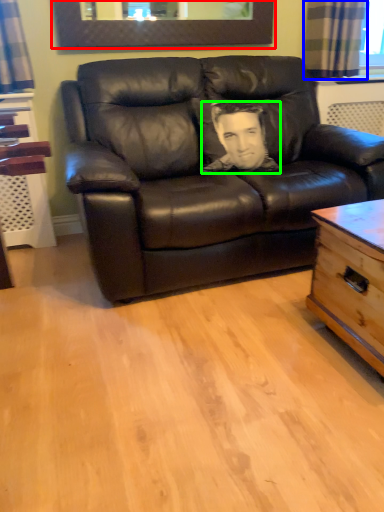
Question: Which object is positioned farthest from picture frame (highlighted by a red box)? Select from curtain (highlighted by a blue box) and man (highlighted by a green box).

Choices:
 (A) curtain
 (B) man

Answer: (B)